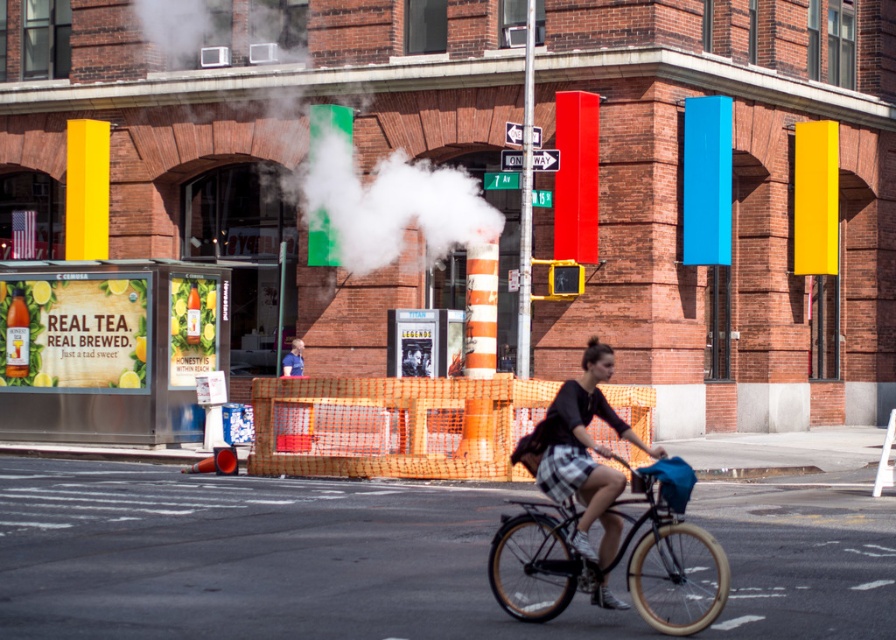
You are a pedestrian trying to cross the street. You see the white vapor at center and the blue shirt at center. How far apart are these two things?

The white vapor at center and the blue shirt at center are 3.65 meters apart from each other.

You are a delivery person on a bike and you see the white vapor at center and the black matte bicycle at center in the image. Which object is bigger?

The white vapor at center is larger in size compared to the black matte bicycle at center.

You are a pedestrian trying to cross the street and see the cyclist with the blue shirt at center and the white vapor at center. Which one is higher from the ground?

The white vapor at center is located above the blue shirt at center, so the white vapor at center is higher from the ground than the blue shirt at center.